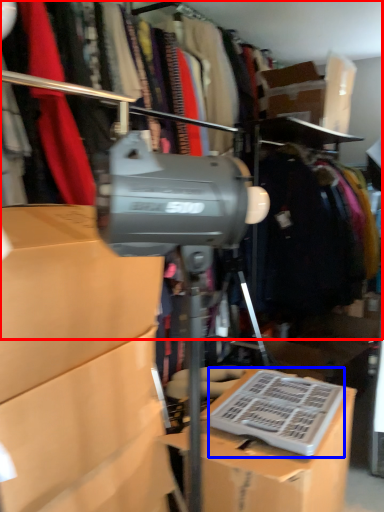
Question: Which object appears farthest to the camera in this image, closet (highlighted by a red box) or wide (highlighted by a blue box)?

Choices:
 (A) closet
 (B) wide

Answer: (B)